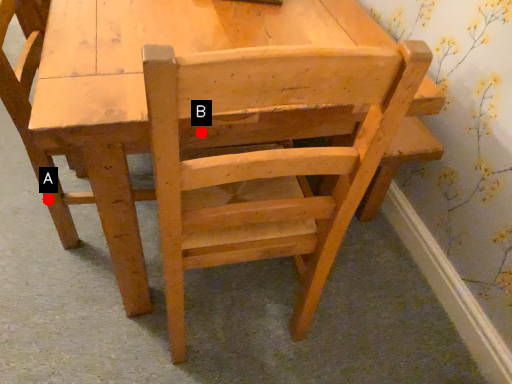
Question: Two points are circled on the image, labeled by A and B beside each circle. Which of the following is the farthest from the observer?

Choices:
 (A) A is further
 (B) B is further

Answer: (A)